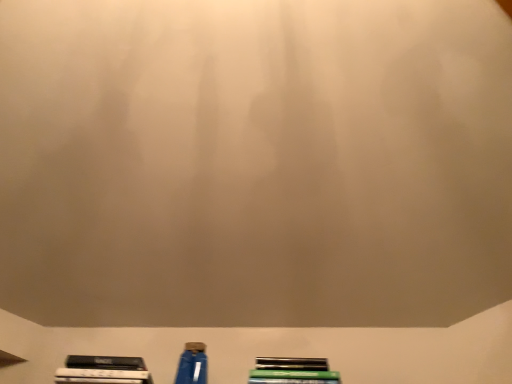
In order to face blue plastic bottle at lower center, should I rotate leftwards or rightwards?

To face it directly, rotate left by 8.567 degrees.

Find the location of a particular element. This screenshot has height=384, width=512. blue plastic bottle at lower center is located at coordinates (192, 364).

The width and height of the screenshot is (512, 384). Describe the element at coordinates (192, 364) in the screenshot. I see `blue plastic bottle at lower center` at that location.

Find the location of a particular element. The height and width of the screenshot is (384, 512). metallic green book at lower center is located at coordinates (292, 371).

The image size is (512, 384). Describe the element at coordinates (292, 371) in the screenshot. I see `metallic green book at lower center` at that location.

In order to click on blue plastic bottle at lower center in this screenshot , I will do `click(192, 364)`.

Which object is positioned more to the right, blue plastic bottle at lower center or metallic green book at lower center?

Positioned to the right is metallic green book at lower center.

Is blue plastic bottle at lower center positioned in front of metallic green book at lower center?

No, blue plastic bottle at lower center is further to the viewer.

Between point (191, 342) and point (263, 372), which one is positioned behind?

The point (191, 342) is behind.

From the image's perspective, is blue plastic bottle at lower center positioned above or below metallic green book at lower center?

From the image's perspective, blue plastic bottle at lower center appears above metallic green book at lower center.

From a real-world perspective, who is located lower, blue plastic bottle at lower center or metallic green book at lower center?

From a 3D spatial view, metallic green book at lower center is below.

Which object is wider, blue plastic bottle at lower center or metallic green book at lower center?

With larger width is metallic green book at lower center.

In terms of height, does blue plastic bottle at lower center look taller or shorter compared to metallic green book at lower center?

blue plastic bottle at lower center is taller than metallic green book at lower center.

Is blue plastic bottle at lower center bigger than metallic green book at lower center?

No.

Is blue plastic bottle at lower center situated inside metallic green book at lower center or outside?

blue plastic bottle at lower center is not enclosed by metallic green book at lower center.

Would you say blue plastic bottle at lower center is a long distance from metallic green book at lower center?

That's not correct — blue plastic bottle at lower center is a little close to metallic green book at lower center.

Is blue plastic bottle at lower center looking in the opposite direction of metallic green book at lower center?

blue plastic bottle at lower center is not turned away from metallic green book at lower center.

How many degrees apart are the facing directions of blue plastic bottle at lower center and metallic green book at lower center?

2.22 degrees separate the facing orientations of blue plastic bottle at lower center and metallic green book at lower center.

I want to click on book below the blue plastic bottle at lower center (from a real-world perspective), so click(x=292, y=371).

Which object is positioned more to the left, metallic green book at lower center or blue plastic bottle at lower center?

blue plastic bottle at lower center is more to the left.

Considering their positions, is metallic green book at lower center located in front of or behind blue plastic bottle at lower center?

In the image, metallic green book at lower center appears in front of blue plastic bottle at lower center.

Which is in front, point (333, 382) or point (189, 343)?

The point (333, 382) is in front.

From the image's perspective, is metallic green book at lower center above or below blue plastic bottle at lower center?

metallic green book at lower center is situated lower than blue plastic bottle at lower center in the image.

From a real-world perspective, which object rests below the other?

metallic green book at lower center, from a real-world perspective.

Can you confirm if metallic green book at lower center is wider than blue plastic bottle at lower center?

Yes, metallic green book at lower center is wider than blue plastic bottle at lower center.

Between metallic green book at lower center and blue plastic bottle at lower center, which one has more height?

blue plastic bottle at lower center is taller.

Does metallic green book at lower center have a larger size compared to blue plastic bottle at lower center?

Correct, metallic green book at lower center is larger in size than blue plastic bottle at lower center.

Is metallic green book at lower center inside or outside of blue plastic bottle at lower center?

metallic green book at lower center is located beyond the bounds of blue plastic bottle at lower center.

Is metallic green book at lower center placed right next to blue plastic bottle at lower center?

They are not placed beside each other.

Could you tell me if metallic green book at lower center is facing blue plastic bottle at lower center?

No, metallic green book at lower center does not turn towards blue plastic bottle at lower center.

Looking at this image, how far apart are metallic green book at lower center and blue plastic bottle at lower center?

They are 14.61 inches apart.

This screenshot has width=512, height=384. Find the location of `book below the blue plastic bottle at lower center (from the image's perspective)`. book below the blue plastic bottle at lower center (from the image's perspective) is located at coordinates (292, 371).

You are a GUI agent. You are given a task and a screenshot of the screen. Output one action in this format:
    pyautogui.click(x=<x>, y=<y>)
    Task: Click on the book that is in front of the blue plastic bottle at lower center
    Image resolution: width=512 pixels, height=384 pixels.
    Given the screenshot: What is the action you would take?
    pyautogui.click(x=292, y=371)

Locate an element on the screen. The image size is (512, 384). book located underneath the blue plastic bottle at lower center (from a real-world perspective) is located at coordinates (292, 371).